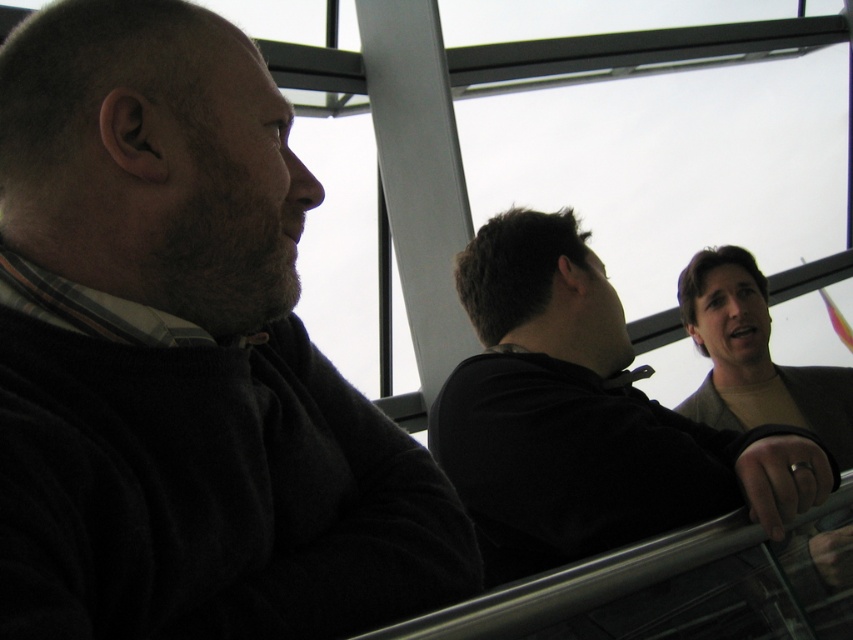
The height and width of the screenshot is (640, 853). What do you see at coordinates (183, 358) in the screenshot? I see `dark matte sweater at left` at bounding box center [183, 358].

Between point (206, 618) and point (763, 330), which one is positioned behind?

The point (763, 330) is more distant.

Is point (132, 45) behind point (743, 316)?

No, (132, 45) is closer to viewer.

Where is `dark matte sweater at left`? This screenshot has height=640, width=853. dark matte sweater at left is located at coordinates (183, 358).

Measure the distance between dark matte sweater at left and camera.

They are 22.86 inches apart.

Is point (109, 426) farther from viewer compared to point (596, 326)?

No, it is not.

Where is `dark matte sweater at left`? Image resolution: width=853 pixels, height=640 pixels. dark matte sweater at left is located at coordinates (183, 358).

Can you confirm if dark gray hoodie at upper right is thinner than matte brown shirt at right?

Yes.

Does point (573, 240) come in front of point (747, 339)?

Yes, point (573, 240) is in front of point (747, 339).

Between point (502, 298) and point (801, 385), which one is positioned behind?

The point (801, 385) is more distant.

Image resolution: width=853 pixels, height=640 pixels. What are the coordinates of `dark gray hoodie at upper right` in the screenshot? It's located at pos(585,417).